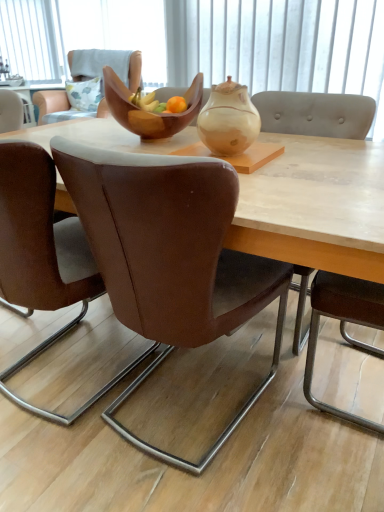
Where is `vacant area in front of matte beige teapot at center`? vacant area in front of matte beige teapot at center is located at coordinates (270, 174).